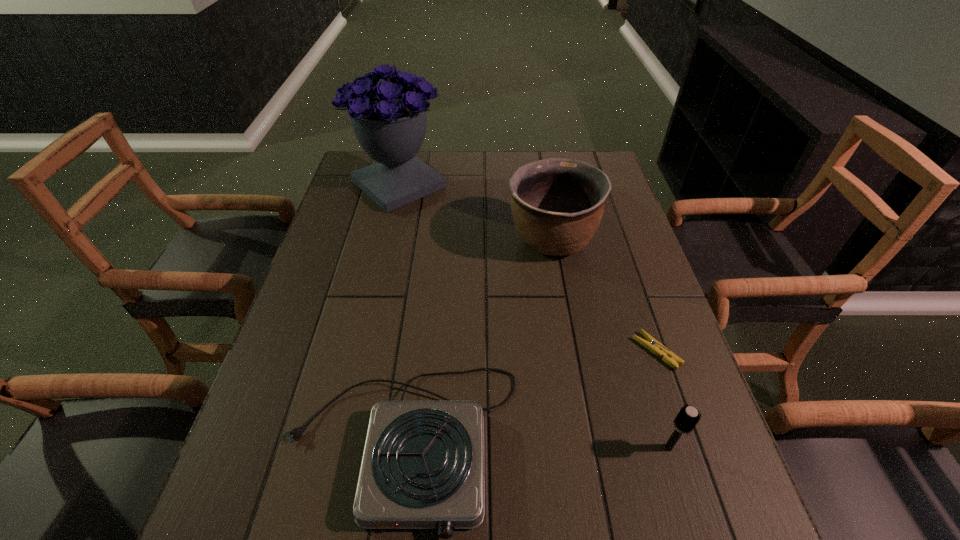
The image size is (960, 540). I want to click on bouquet, so click(389, 121).

In order to click on pottery in this screenshot , I will do `click(557, 204)`.

Where is `the third tallest object`? The width and height of the screenshot is (960, 540). the third tallest object is located at coordinates (687, 418).

Find the location of `clothespin`. clothespin is located at coordinates (652, 344).

Find the location of a particular element. The height and width of the screenshot is (540, 960). free point located 0.100m on the right of the tallest object is located at coordinates (476, 185).

Locate an element on the screen. The image size is (960, 540). free spot located 0.120m on the left of the second tallest object is located at coordinates (464, 240).

Locate an element on the screen. The height and width of the screenshot is (540, 960). vacant space positioned on the back of the third tallest object is located at coordinates (625, 306).

I want to click on vacant space situated on the left of the shortest object, so click(x=605, y=351).

Locate an element on the screen. object present at the far edge is located at coordinates (389, 121).

This screenshot has height=540, width=960. Identify the location of object at the left edge. (389, 121).